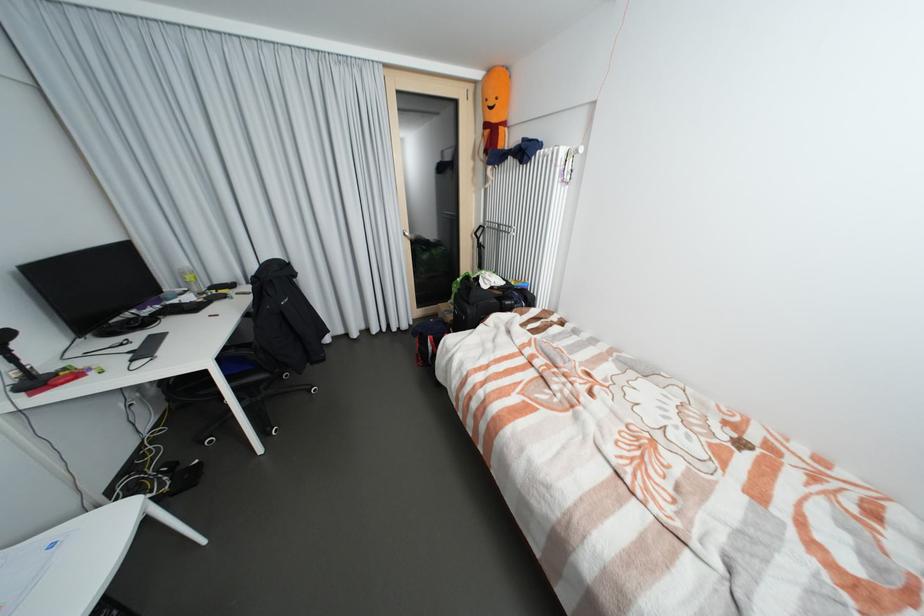
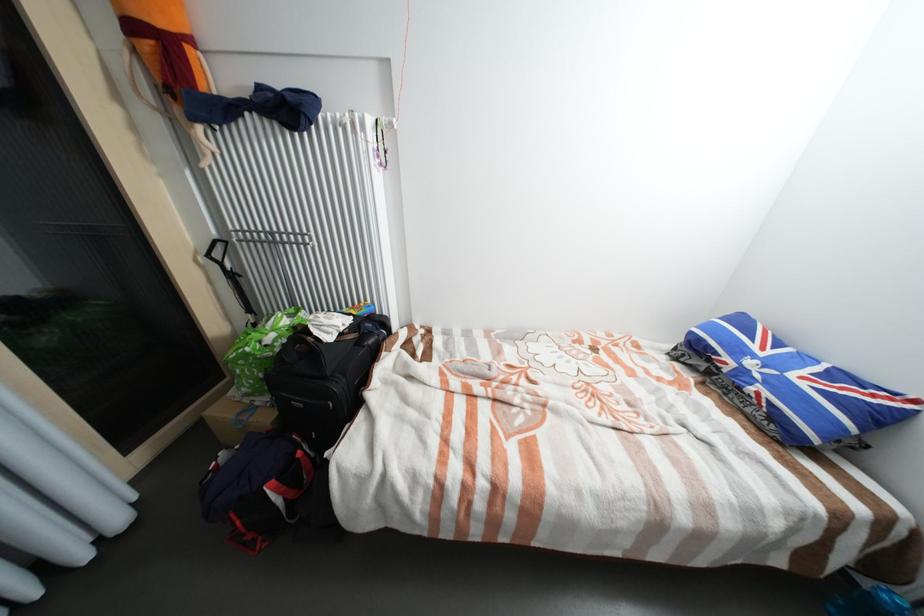
The point at (517, 299) is marked in the first image. Where is the corresponding point in the second image?

(377, 334)